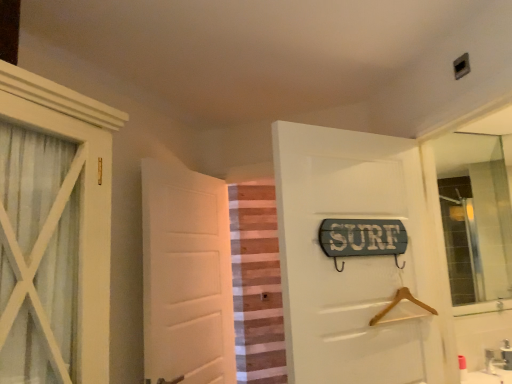
In the scene shown: What is the approximate height of striped fabric curtain at center?

It is 4.52 feet.

Where is `wooden sign at center, acting as the 2th door starting from the back`? The height and width of the screenshot is (384, 512). wooden sign at center, acting as the 2th door starting from the back is located at coordinates (353, 259).

The image size is (512, 384). What do you see at coordinates (186, 276) in the screenshot?
I see `white matte door at center, placed as the second door when sorted from front to back` at bounding box center [186, 276].

Locate an element on the screen. striped fabric curtain at center is located at coordinates (257, 285).

Considering the sizes of clear glass mirror at upper right and wooden sign at center, acting as the 2th door starting from the back, in the image, is clear glass mirror at upper right bigger or smaller than wooden sign at center, acting as the 2th door starting from the back,?

In the image, clear glass mirror at upper right appears to be smaller than wooden sign at center, acting as the 2th door starting from the back.

Considering the relative sizes of clear glass mirror at upper right and wooden sign at center, the first door from the front, in the image provided, is clear glass mirror at upper right taller than wooden sign at center, the first door from the front,?

No, clear glass mirror at upper right is not taller than wooden sign at center, the first door from the front.

From the image's perspective, which is below, clear glass mirror at upper right or wooden sign at center, which is the first door in right-to-left order?

wooden sign at center, which is the first door in right-to-left order, from the image's perspective.

Which object is wider, clear glass mirror at upper right or wooden sign at center, acting as the 2th door starting from the back?

With larger width is wooden sign at center, acting as the 2th door starting from the back.

From a real-world perspective, which object rests below the other?

In real-world perspective, striped fabric curtain at center is lower.

Which of these two, striped fabric curtain at center or white matte door at center, which is the 2th door from right to left, is thinner?

With smaller width is striped fabric curtain at center.

Between point (268, 374) and point (173, 206), which one is positioned in front?

Point (173, 206)

Considering the positions of objects striped fabric curtain at center and white matte door at center, placed as the second door when sorted from front to back, in the image provided, who is behind, striped fabric curtain at center or white matte door at center, placed as the second door when sorted from front to back,?

striped fabric curtain at center is further from the camera.

From a real-world perspective, is wooden sign at center, which appears as the 2th door when viewed from the left, positioned under clear glass mirror at upper right based on gravity?

Yes, from a real-world perspective, wooden sign at center, which appears as the 2th door when viewed from the left, is below clear glass mirror at upper right.

Is wooden sign at center, which is the first door in right-to-left order, oriented towards clear glass mirror at upper right?

No, wooden sign at center, which is the first door in right-to-left order, is not aimed at clear glass mirror at upper right.

Who is smaller, wooden sign at center, which appears as the 2th door when viewed from the left, or clear glass mirror at upper right?

Smaller between the two is clear glass mirror at upper right.

Between clear glass mirror at upper right and white matte door at center, placed as the second door when sorted from front to back, which one has larger size?

white matte door at center, placed as the second door when sorted from front to back.

Considering their positions, is clear glass mirror at upper right located in front of or behind white matte door at center, which is the 2th door from right to left?

Clearly, clear glass mirror at upper right is behind white matte door at center, which is the 2th door from right to left.

Is clear glass mirror at upper right directly adjacent to white matte door at center, the first door in the back-to-front sequence?

There is a gap between clear glass mirror at upper right and white matte door at center, the first door in the back-to-front sequence.

Which is nearer, (473,233) or (165,244)?

Point (473,233) is farther from the camera than point (165,244).

Which is in front, clear glass mirror at upper right or striped fabric curtain at center?

clear glass mirror at upper right.

Is clear glass mirror at upper right smaller than striped fabric curtain at center?

Correct, clear glass mirror at upper right occupies less space than striped fabric curtain at center.

Is clear glass mirror at upper right beside striped fabric curtain at center?

No, clear glass mirror at upper right is not in contact with striped fabric curtain at center.

Considering the sizes of white matte door at center, which is the 2th door from right to left, and wooden sign at center, the first door from the front, in the image, is white matte door at center, which is the 2th door from right to left, bigger or smaller than wooden sign at center, the first door from the front,?

Considering their sizes, white matte door at center, which is the 2th door from right to left, takes up more space than wooden sign at center, the first door from the front.

Considering the positions of objects white matte door at center, the first door in the back-to-front sequence, and wooden sign at center, the first door from the front, in the image provided, who is more to the right, white matte door at center, the first door in the back-to-front sequence, or wooden sign at center, the first door from the front,?

From the viewer's perspective, wooden sign at center, the first door from the front, appears more on the right side.

Does point (181, 300) come closer to viewer compared to point (332, 338)?

No, (181, 300) is behind (332, 338).

Considering the positions of objects white matte door at center, the 1th door in the left-to-right sequence, and wooden sign at center, which is the first door in right-to-left order, in the image provided, who is in front, white matte door at center, the 1th door in the left-to-right sequence, or wooden sign at center, which is the first door in right-to-left order,?

Positioned in front is wooden sign at center, which is the first door in right-to-left order.

Would you say white matte door at center, which is the 2th door from right to left, contains striped fabric curtain at center?

No, striped fabric curtain at center is located outside of white matte door at center, which is the 2th door from right to left.

Considering the positions of objects white matte door at center, the 1th door in the left-to-right sequence, and striped fabric curtain at center in the image provided, who is behind, white matte door at center, the 1th door in the left-to-right sequence, or striped fabric curtain at center?

Positioned behind is striped fabric curtain at center.

How much distance is there between white matte door at center, the first door in the back-to-front sequence, and striped fabric curtain at center?

They are 1.35 meters apart.

Considering the sizes of objects white matte door at center, the 1th door in the left-to-right sequence, and striped fabric curtain at center in the image provided, who is smaller, white matte door at center, the 1th door in the left-to-right sequence, or striped fabric curtain at center?

striped fabric curtain at center.

Identify the location of mirror on the right side of wooden sign at center, the first door from the front. (475, 216).

Identify the location of door to the left of striped fabric curtain at center. The width and height of the screenshot is (512, 384). (186, 276).

From the picture: Estimate the real-world distances between objects in this image. Which object is further from wooden sign at center, which appears as the 2th door when viewed from the left, striped fabric curtain at center or clear glass mirror at upper right?

Among the two, striped fabric curtain at center is located further to wooden sign at center, which appears as the 2th door when viewed from the left.

When comparing their distances from striped fabric curtain at center, does white matte door at center, which is the 2th door from right to left, or wooden sign at center, acting as the 2th door starting from the back, seem further?

The object further to striped fabric curtain at center is wooden sign at center, acting as the 2th door starting from the back.

Which object lies further to the anchor point clear glass mirror at upper right, white matte door at center, which is the 2th door from right to left, or wooden sign at center, the first door from the front?

white matte door at center, which is the 2th door from right to left, is positioned further to the anchor clear glass mirror at upper right.

When comparing their distances from clear glass mirror at upper right, does striped fabric curtain at center or white matte door at center, which is the 2th door from right to left, seem closer?

striped fabric curtain at center is closer to clear glass mirror at upper right.

Based on their spatial positions, is white matte door at center, the first door in the back-to-front sequence, or clear glass mirror at upper right closer to wooden sign at center, acting as the 2th door starting from the back?

The object closer to wooden sign at center, acting as the 2th door starting from the back, is white matte door at center, the first door in the back-to-front sequence.

Based on their spatial positions, is wooden sign at center, which appears as the 2th door when viewed from the left, or striped fabric curtain at center further from white matte door at center, the first door in the back-to-front sequence?

striped fabric curtain at center.

Looking at the image, which one is located closer to wooden sign at center, acting as the 2th door starting from the back, clear glass mirror at upper right or white matte door at center, the first door in the back-to-front sequence?

white matte door at center, the first door in the back-to-front sequence.

Considering their positions, is white matte door at center, placed as the second door when sorted from front to back, positioned closer to striped fabric curtain at center than clear glass mirror at upper right?

white matte door at center, placed as the second door when sorted from front to back.

Find the location of a particular element. Image resolution: width=512 pixels, height=384 pixels. door between wooden sign at center, the first door from the front, and striped fabric curtain at center, along the z-axis is located at coordinates (186, 276).

I want to click on door situated between striped fabric curtain at center and clear glass mirror at upper right from left to right, so click(353, 259).

In order to click on curtain located between white matte door at center, which is the 2th door from right to left, and clear glass mirror at upper right in the left-right direction in this screenshot , I will do `click(257, 285)`.

Locate an element on the screen. door situated between white matte door at center, placed as the second door when sorted from front to back, and clear glass mirror at upper right from left to right is located at coordinates (353, 259).